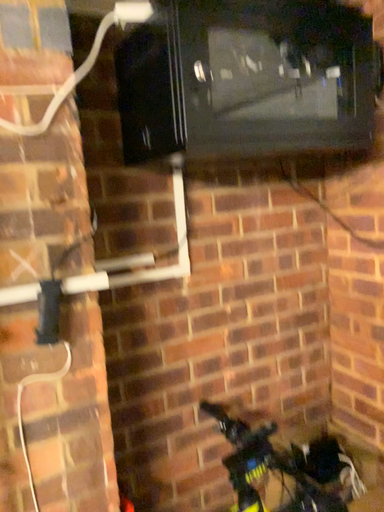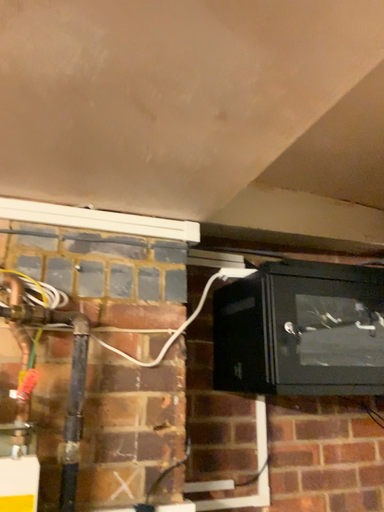
Question: How did the camera likely rotate when shooting the video?

Choices:
 (A) rotated downward
 (B) rotated upward

Answer: (B)